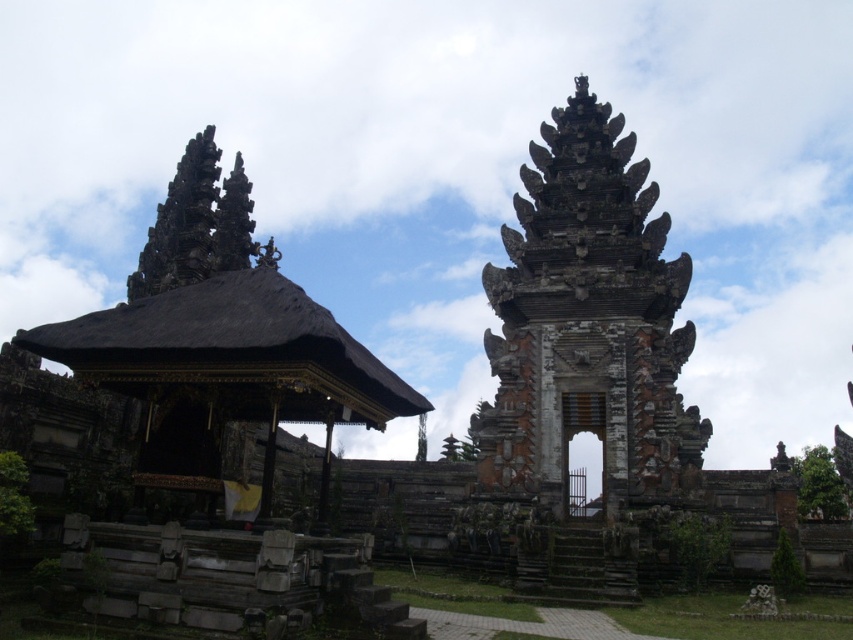
Does point (672, 305) come farther from viewer compared to point (123, 317)?

Yes, point (672, 305) is farther from viewer.

Does dark brown stone temple at right have a larger size compared to black stone gazebo at center?

No, dark brown stone temple at right is not bigger than black stone gazebo at center.

Locate an element on the screen. The image size is (853, 640). dark brown stone temple at right is located at coordinates (587, 326).